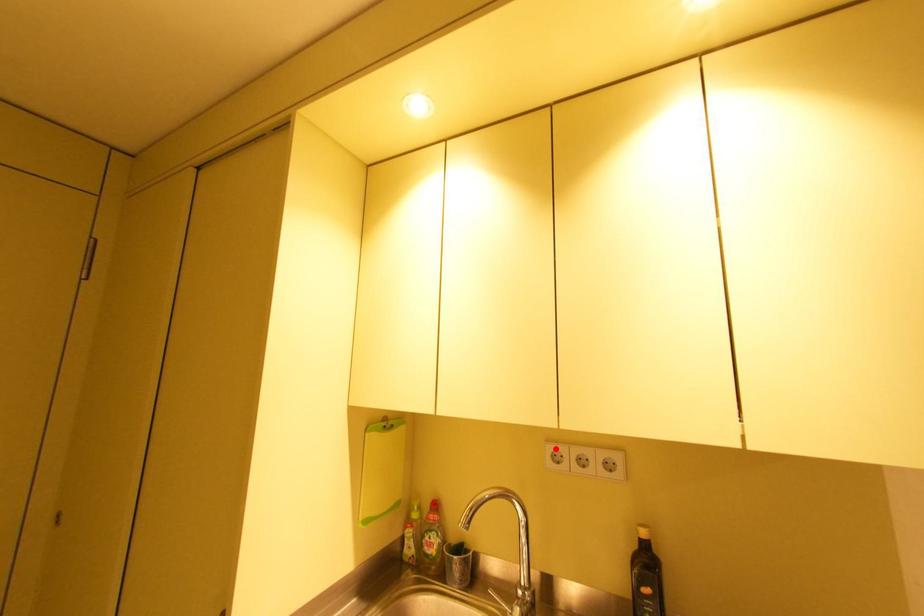
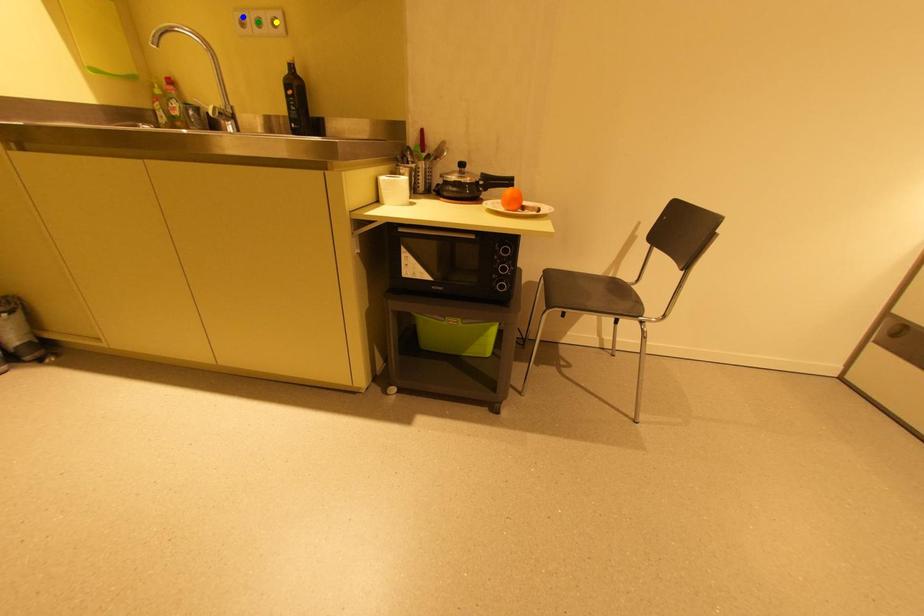
Question: I am providing you with two images of the same scene from different viewpoints. A red point is marked on the first image. You are given multiple points on the second image. In image 2, which mark is for the same physical point as the one in image 1?

Choices:
 (A) green point
 (B) yellow point
 (C) blue point

Answer: (C)